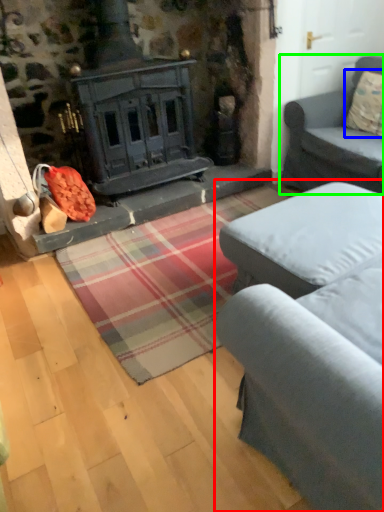
Question: Which object is the closest to the studio couch (highlighted by a red box)? Choose among these: pillow (highlighted by a blue box) or studio couch (highlighted by a green box).

Choices:
 (A) pillow
 (B) studio couch

Answer: (B)